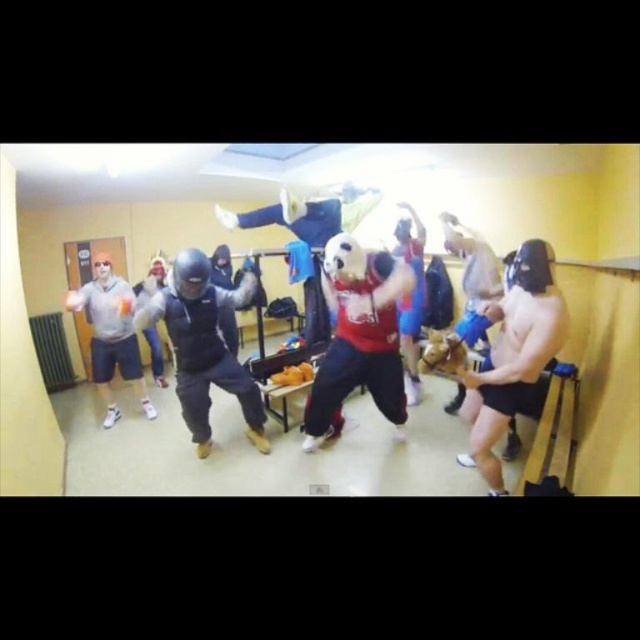
You are a photographer setting up for a group photo in the gym. You need to position the shiny metallic helmet at right and the matte gray hoodie at left so they are both visible in the frame. Based on their current positions, which object is closer to the right edge of the image?

The shiny metallic helmet at right is positioned on the right side of the matte gray hoodie at left, so it is closer to the right edge of the image.